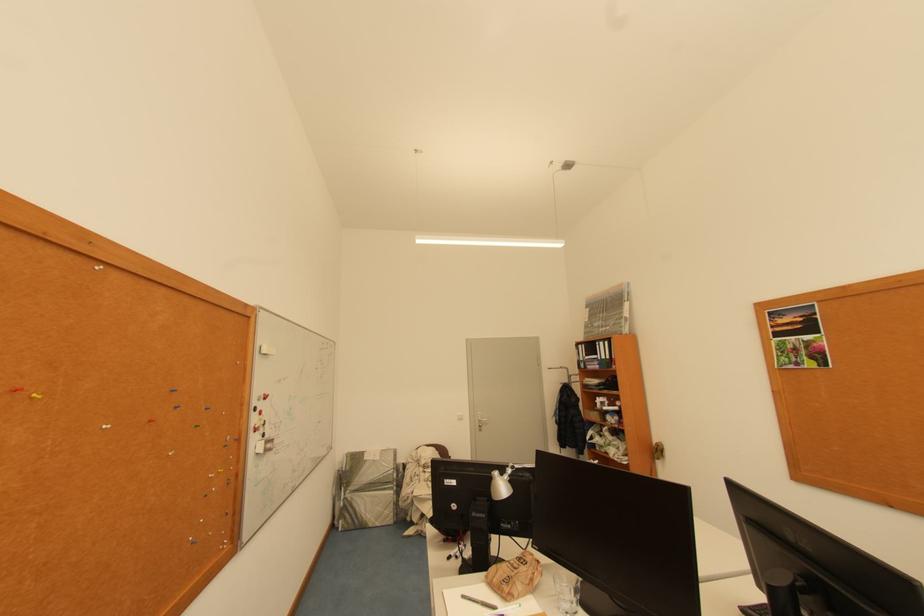
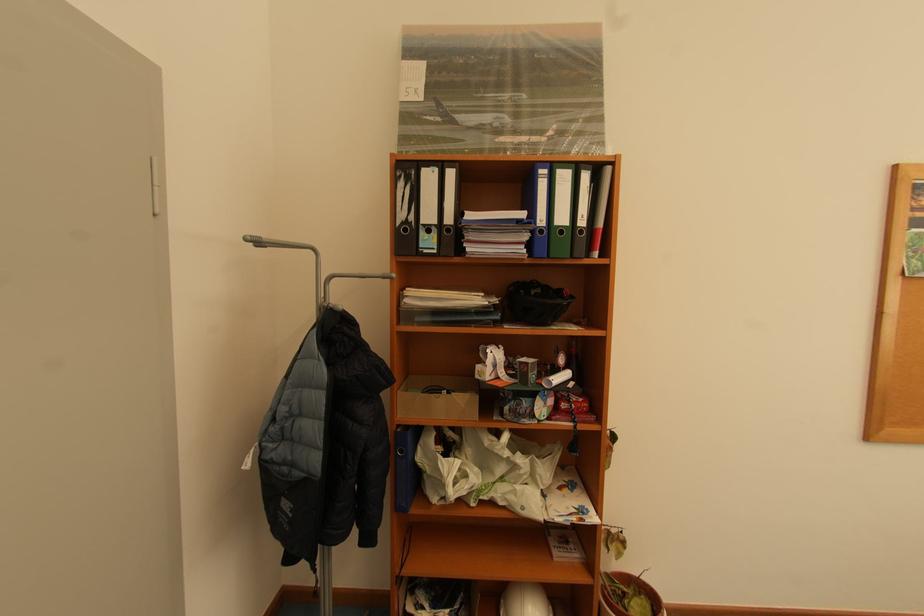
Where in the second image is the point corresponding to pixel 605 344 from the first image?

(552, 172)